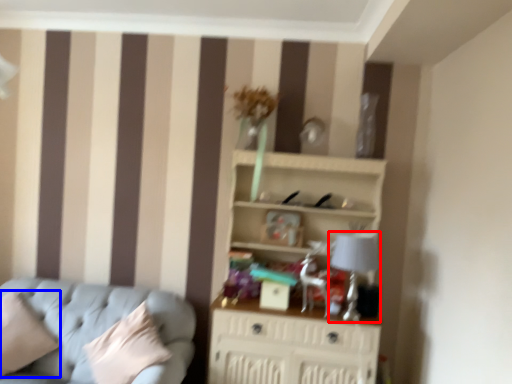
Question: Which point is closer to the camera, table lamp (highlighted by a red box) or pillow (highlighted by a blue box)?

Choices:
 (A) table lamp
 (B) pillow

Answer: (B)